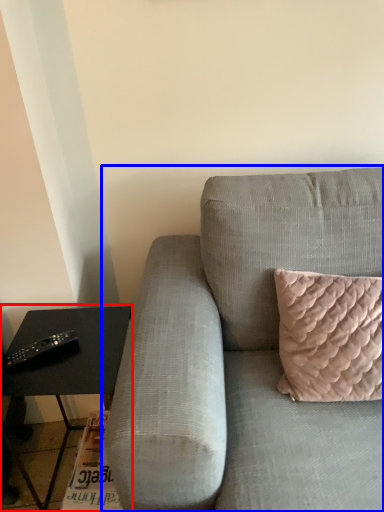
Question: Among these objects, which one is farthest to the camera, table (highlighted by a red box) or studio couch (highlighted by a blue box)?

Choices:
 (A) table
 (B) studio couch

Answer: (A)